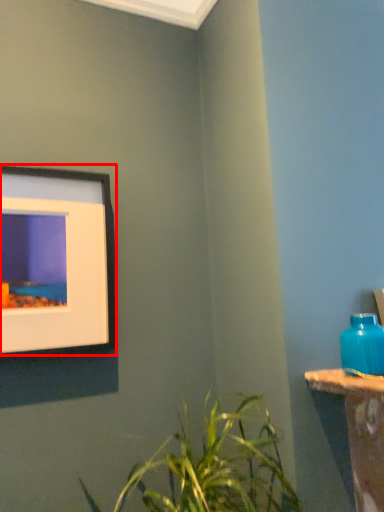
Question: From the image's perspective, what is the correct spatial relationship of picture frame (annotated by the red box) in relation to bottle?

Choices:
 (A) above
 (B) below

Answer: (A)